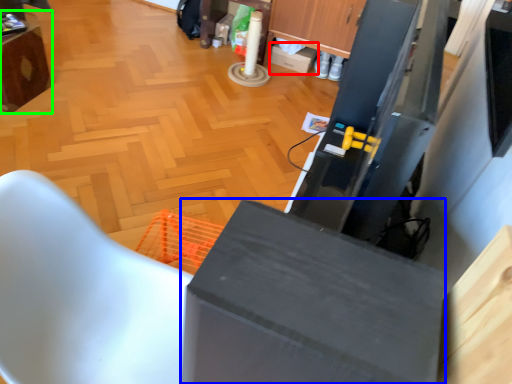
Question: Considering the real-world distances, which object is farthest from box (highlighted by a red box)? cabinetry (highlighted by a blue box) or furniture (highlighted by a green box)?

Choices:
 (A) cabinetry
 (B) furniture

Answer: (A)